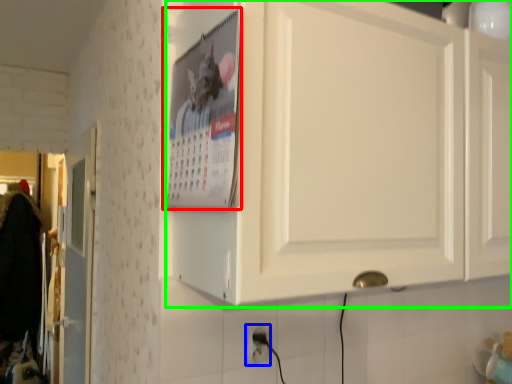
Question: Which is farther away from poster page (highlighted by a red box)? electric outlet (highlighted by a blue box) or cabinetry (highlighted by a green box)?

Choices:
 (A) electric outlet
 (B) cabinetry

Answer: (A)